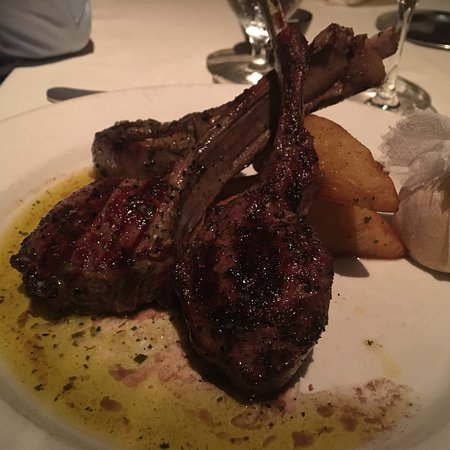
Identify the location of white table cloth. The height and width of the screenshot is (450, 450). (22, 434), (446, 442), (145, 26).